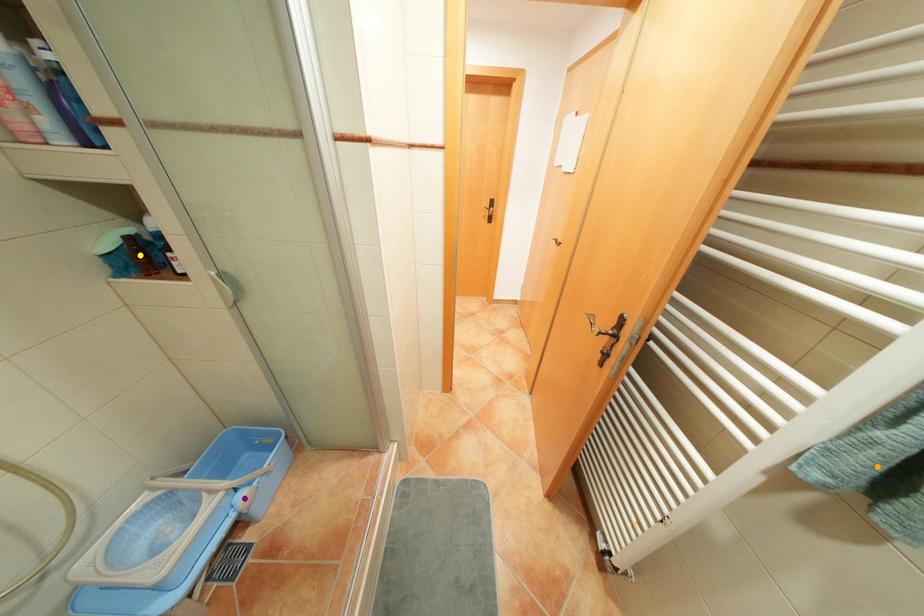
Order these from nearest to farthest:
purple point, orange point, yellow point

purple point < yellow point < orange point